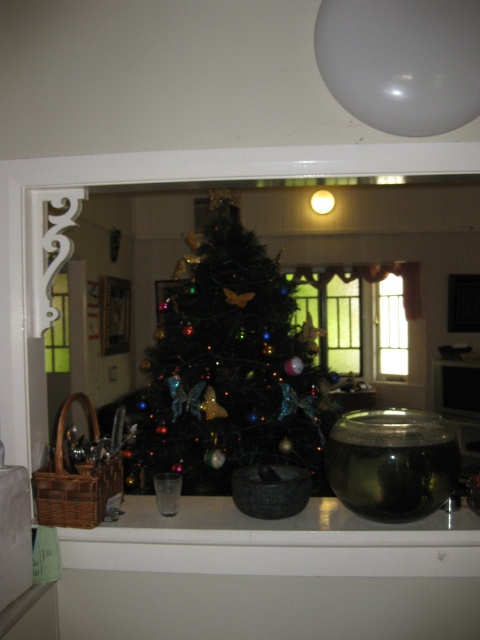
Question: Can you confirm if shiny green christmas tree at center is smaller than translucent glass window at center?

Choices:
 (A) no
 (B) yes

Answer: (A)

Question: Is shiny green christmas tree at center above translucent glass window at center?

Choices:
 (A) yes
 (B) no

Answer: (A)

Question: Is shiny green christmas tree at center smaller than translucent glass window at center?

Choices:
 (A) yes
 (B) no

Answer: (B)

Question: Which of the following is the farthest from the observer?

Choices:
 (A) (307, 356)
 (B) (315, 356)

Answer: (B)